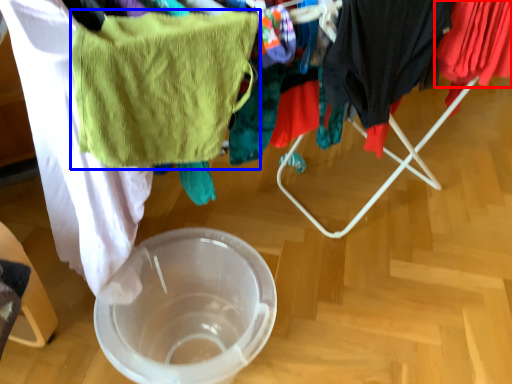
Question: Which object appears closest to the camera in this image, clothing (highlighted by a red box) or towel/napkin (highlighted by a blue box)?

Choices:
 (A) clothing
 (B) towel/napkin

Answer: (B)